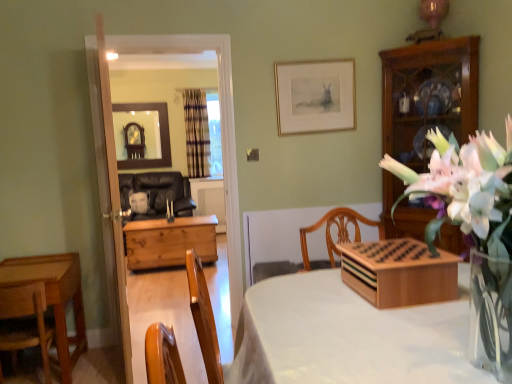
Image resolution: width=512 pixels, height=384 pixels. What do you see at coordinates (474, 230) in the screenshot?
I see `white glossy vase at center right` at bounding box center [474, 230].

You are a GUI agent. You are given a task and a screenshot of the screen. Output one action in this format:
    pyautogui.click(x=<x>, y=<y>)
    Task: Click on the white glossy vase at center right
    
    Given the screenshot: What is the action you would take?
    pyautogui.click(x=474, y=230)

Describe the element at coordinates (196, 132) in the screenshot. I see `plaid fabric curtain at center` at that location.

This screenshot has width=512, height=384. Describe the element at coordinates (399, 272) in the screenshot. I see `wooden game board at center` at that location.

What do you see at coordinates (158, 193) in the screenshot? This screenshot has width=512, height=384. I see `black leather couch at left, the 1th chair positioned from the top` at bounding box center [158, 193].

Locate an element on the screen. matte glass mirror at upper center is located at coordinates pyautogui.click(x=142, y=135).

Considering the sizes of objects wooden door at left and matte gold picture frame at upper center in the image provided, who is bigger, wooden door at left or matte gold picture frame at upper center?

With larger size is wooden door at left.

From the image's perspective, is wooden door at left located above or below matte gold picture frame at upper center?

wooden door at left is situated lower than matte gold picture frame at upper center in the image.

This screenshot has height=384, width=512. In order to click on picture frame that is above the wooden door at left (from a real-world perspective) in this screenshot , I will do `click(315, 96)`.

Considering the relative positions of plaid fabric curtain at center and matte gold picture frame at upper center in the image provided, is plaid fabric curtain at center behind matte gold picture frame at upper center?

Yes, it is behind matte gold picture frame at upper center.

Is plaid fabric curtain at center spatially inside matte gold picture frame at upper center, or outside of it?

plaid fabric curtain at center is not inside matte gold picture frame at upper center, it's outside.

From a real-world perspective, is plaid fabric curtain at center physically above matte gold picture frame at upper center?

No, from a real-world perspective, plaid fabric curtain at center is not on top of matte gold picture frame at upper center.

From the image's perspective, would you say matte gold picture frame at upper center is shown under matte glass mirror at upper center?

Yes.

Is matte gold picture frame at upper center positioned with its back to matte glass mirror at upper center?

Correct, matte gold picture frame at upper center is looking away from matte glass mirror at upper center.

Based on their sizes in the image, would you say matte gold picture frame at upper center is bigger or smaller than matte glass mirror at upper center?

Considering their sizes, matte gold picture frame at upper center takes up less space than matte glass mirror at upper center.

Which of these two, matte gold picture frame at upper center or matte glass mirror at upper center, stands taller?

matte glass mirror at upper center.

From the image's perspective, which is above, plaid fabric curtain at center or wooden chair at lower left, marked as the 1th chair in a bottom-to-top arrangement?

plaid fabric curtain at center.

Which point is more distant from viewer, (189, 141) or (21, 307)?

Point (189, 141)

Consider the image. Can you confirm if plaid fabric curtain at center is bigger than wooden chair at lower left, the first chair positioned from the front?

Yes, plaid fabric curtain at center is bigger than wooden chair at lower left, the first chair positioned from the front.

Is plaid fabric curtain at center facing away from wooden chair at lower left, the 2th chair viewed from the back?

No, plaid fabric curtain at center's orientation is not away from wooden chair at lower left, the 2th chair viewed from the back.

Does transparent glass door at upper center appear on the left side of matte gold picture frame at upper center?

Indeed, transparent glass door at upper center is positioned on the left side of matte gold picture frame at upper center.

Does transparent glass door at upper center have a lesser height compared to matte gold picture frame at upper center?

In fact, transparent glass door at upper center may be taller than matte gold picture frame at upper center.

In terms of size, does transparent glass door at upper center appear bigger or smaller than matte gold picture frame at upper center?

Considering their sizes, transparent glass door at upper center takes up more space than matte gold picture frame at upper center.

Locate an element on the screen. The height and width of the screenshot is (384, 512). glass door that appears below the matte gold picture frame at upper center (from the image's perspective) is located at coordinates (116, 163).

Is black leather couch at left, which ranks as the second chair in front-to-back order, facing towards wooden door at left?

Yes, black leather couch at left, which ranks as the second chair in front-to-back order, is aimed at wooden door at left.

Looking at this image, from a real-world perspective, is black leather couch at left, the second chair from the bottom, above or below wooden door at left?

black leather couch at left, the second chair from the bottom, is situated lower than wooden door at left in the real world.

Are black leather couch at left, the second chair from the bottom, and wooden door at left making contact?

There is a gap between black leather couch at left, the second chair from the bottom, and wooden door at left.

Does point (163, 174) come behind point (103, 76)?

Yes, it is behind point (103, 76).

Can you confirm if transparent glass door at upper center is bigger than white glossy vase at center right?

Yes, transparent glass door at upper center is bigger than white glossy vase at center right.

Are transparent glass door at upper center and white glossy vase at center right beside each other?

No, transparent glass door at upper center is not next to white glossy vase at center right.

What are the coordinates of `floral arrangement in front of the transparent glass door at upper center` in the screenshot? It's located at (474, 230).

Identify the location of picture frame behind the wooden door at left. (315, 96).

In the image, there is a matte gold picture frame at upper center. Where is `curtain below it (from a real-world perspective)`? This screenshot has height=384, width=512. curtain below it (from a real-world perspective) is located at coordinates (196, 132).

Estimate the real-world distances between objects in this image. Which object is closer to matte gold picture frame at upper center, white glossy vase at center right or matte glass mirror at upper center?

Based on the image, white glossy vase at center right appears to be nearer to matte gold picture frame at upper center.

Based on the photo, considering their positions, is matte gold picture frame at upper center positioned further to plaid fabric curtain at center than wooden chair at lower left, marked as the 1th chair in a bottom-to-top arrangement?

Based on the image, wooden chair at lower left, marked as the 1th chair in a bottom-to-top arrangement, appears to be further to plaid fabric curtain at center.

Considering their positions, is matte glass mirror at upper center positioned further to transparent glass door at upper center than white glossy vase at center right?

matte glass mirror at upper center lies further to transparent glass door at upper center than the other object.

Estimate the real-world distances between objects in this image. Which object is closer to wooden cabinet at right, white glossy vase at center right or matte gold picture frame at upper center?

The object closer to wooden cabinet at right is matte gold picture frame at upper center.

From the image, which object appears to be farther from wooden chair at lower left, the 2th chair viewed from the back, matte glass mirror at upper center or wooden door at left?

matte glass mirror at upper center lies further to wooden chair at lower left, the 2th chair viewed from the back, than the other object.

From the image, which object appears to be nearer to white glossy vase at center right, wooden door at left or black leather couch at left, the first chair in the back-to-front sequence?

wooden door at left lies closer to white glossy vase at center right than the other object.

Based on their spatial positions, is wooden door at left or wooden chest at center further from wooden cabinet at right?

wooden chest at center lies further to wooden cabinet at right than the other object.

Estimate the real-world distances between objects in this image. Which object is further from white glossy vase at center right, matte glass mirror at upper center or wooden chest at center?

matte glass mirror at upper center is positioned further to the anchor white glossy vase at center right.

Where is `glass door between wooden game board at center and wooden chest at center from front to back`? The height and width of the screenshot is (384, 512). glass door between wooden game board at center and wooden chest at center from front to back is located at coordinates (116, 163).

Find the location of a particular element. The image size is (512, 384). glass door located between wooden chair at lower left, the first chair positioned from the front, and plaid fabric curtain at center in the depth direction is located at coordinates (116, 163).

Where is `picture frame between wooden chair at lower left, marked as the 2th chair in a top-to-bottom arrangement, and wooden game board at center`? The width and height of the screenshot is (512, 384). picture frame between wooden chair at lower left, marked as the 2th chair in a top-to-bottom arrangement, and wooden game board at center is located at coordinates (315, 96).

Find the location of a particular element. glass door between wooden door at left and matte glass mirror at upper center along the z-axis is located at coordinates (116, 163).